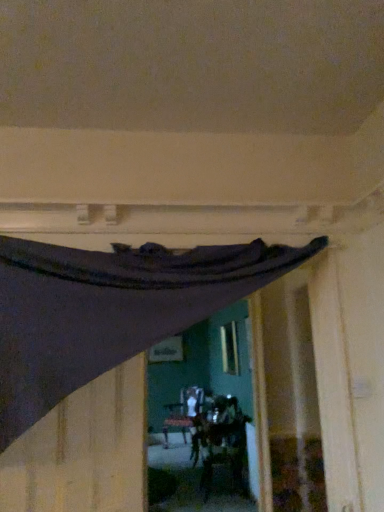
In order to face dark matte fabric at upper left, should I rotate leftwards or rightwards?

Turn left by 15.757 degrees to look at dark matte fabric at upper left.

This screenshot has width=384, height=512. I want to click on dark matte fabric at upper left, so click(x=84, y=450).

This screenshot has width=384, height=512. What do you see at coordinates (84, 450) in the screenshot?
I see `dark matte fabric at upper left` at bounding box center [84, 450].

This screenshot has width=384, height=512. I want to click on dark fabric curtain at upper center, so click(109, 310).

Describe the element at coordinates (109, 310) in the screenshot. Image resolution: width=384 pixels, height=512 pixels. I see `dark fabric curtain at upper center` at that location.

You are a GUI agent. You are given a task and a screenshot of the screen. Output one action in this format:
    pyautogui.click(x=<x>, y=<y>)
    Task: Click on the dark matte fabric at upper left
    Image resolution: width=384 pixels, height=512 pixels.
    Given the screenshot: What is the action you would take?
    pyautogui.click(x=84, y=450)

Considering the positions of objects dark matte fabric at upper left and dark fabric curtain at upper center in the image provided, who is more to the right, dark matte fabric at upper left or dark fabric curtain at upper center?

dark fabric curtain at upper center is more to the right.

Is dark matte fabric at upper left further to the viewer compared to dark fabric curtain at upper center?

That is True.

Does point (135, 484) appear closer or farther from the camera than point (163, 316)?

Clearly, point (135, 484) is more distant from the camera than point (163, 316).

Looking at this image, from the image's perspective, which one is positioned lower, dark matte fabric at upper left or dark fabric curtain at upper center?

From the image's view, dark matte fabric at upper left is below.

Consider the image. From a real-world perspective, is dark matte fabric at upper left under dark fabric curtain at upper center?

Indeed, from a real-world perspective, dark matte fabric at upper left is positioned beneath dark fabric curtain at upper center.

Can you confirm if dark matte fabric at upper left is thinner than dark fabric curtain at upper center?

Indeed, dark matte fabric at upper left has a lesser width compared to dark fabric curtain at upper center.

Which of these two, dark matte fabric at upper left or dark fabric curtain at upper center, stands shorter?

dark matte fabric at upper left.

Considering the relative sizes of dark matte fabric at upper left and dark fabric curtain at upper center in the image provided, is dark matte fabric at upper left bigger than dark fabric curtain at upper center?

No, dark matte fabric at upper left is not bigger than dark fabric curtain at upper center.

Could dark fabric curtain at upper center be considered to be inside dark matte fabric at upper left?

No, dark fabric curtain at upper center is not a part of dark matte fabric at upper left.

Is dark matte fabric at upper left placed right next to dark fabric curtain at upper center?

They are not placed beside each other.

Is dark fabric curtain at upper center at the back of dark matte fabric at upper left?

Yes.

In order to click on plywood behind the dark fabric curtain at upper center in this screenshot , I will do pos(84,450).

Which object is positioned more to the left, dark fabric curtain at upper center or dark matte fabric at upper left?

dark matte fabric at upper left.

Which object is closer to the camera taking this photo, dark fabric curtain at upper center or dark matte fabric at upper left?

dark fabric curtain at upper center is more forward.

Is point (2, 310) closer to camera compared to point (87, 482)?

Yes, it is in front of point (87, 482).

From the image's perspective, is dark fabric curtain at upper center located above dark matte fabric at upper left?

Yes, from the image's perspective, dark fabric curtain at upper center is above dark matte fabric at upper left.

From a real-world perspective, relative to dark matte fabric at upper left, is dark fabric curtain at upper center vertically above or below?

From a real-world perspective, dark fabric curtain at upper center is physically above dark matte fabric at upper left.

Can you confirm if dark fabric curtain at upper center is wider than dark matte fabric at upper left?

Correct, the width of dark fabric curtain at upper center exceeds that of dark matte fabric at upper left.

Does dark fabric curtain at upper center have a greater height compared to dark matte fabric at upper left?

Correct, dark fabric curtain at upper center is much taller as dark matte fabric at upper left.

Which of these two, dark fabric curtain at upper center or dark matte fabric at upper left, is smaller?

dark matte fabric at upper left is smaller.

Would you say dark fabric curtain at upper center contains dark matte fabric at upper left?

Yes, dark fabric curtain at upper center is surrounding dark matte fabric at upper left.

Is the surface of dark fabric curtain at upper center in direct contact with dark matte fabric at upper left?

No, dark fabric curtain at upper center is not next to dark matte fabric at upper left.

Looking at this image, is dark fabric curtain at upper center aimed at dark matte fabric at upper left?

Yes.

How different are the orientations of dark fabric curtain at upper center and dark matte fabric at upper left in degrees?

The angular difference between dark fabric curtain at upper center and dark matte fabric at upper left is 16.2 degrees.

Where is `curtain in front of the dark matte fabric at upper left`? This screenshot has width=384, height=512. curtain in front of the dark matte fabric at upper left is located at coordinates [109, 310].

Locate an element on the screen. Image resolution: width=384 pixels, height=512 pixels. curtain in front of the dark matte fabric at upper left is located at coordinates (109, 310).

In order to click on curtain located on the right of dark matte fabric at upper left in this screenshot , I will do `click(109, 310)`.